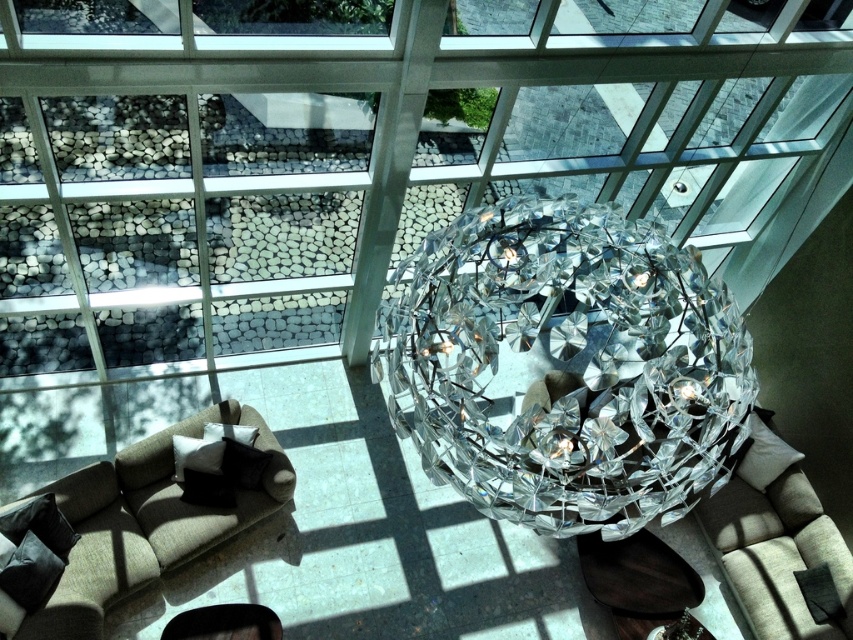
Which is below, clear crystal disco ball at center or beige fabric couch at lower right?

beige fabric couch at lower right

Is clear crystal disco ball at center positioned behind beige fabric couch at lower right?

No.

Is point (531, 269) behind point (828, 621)?

That is False.

This screenshot has width=853, height=640. Identify the location of clear crystal disco ball at center. (567, 365).

Is point (158, 496) less distant than point (782, 470)?

Yes, point (158, 496) is closer to viewer.

The width and height of the screenshot is (853, 640). Describe the element at coordinates (144, 522) in the screenshot. I see `beige fabric couch at lower left` at that location.

Between point (160, 508) and point (844, 544), which one is positioned in front?

Point (160, 508) is in front.

The width and height of the screenshot is (853, 640). Find the location of `beige fabric couch at lower left`. beige fabric couch at lower left is located at coordinates (144, 522).

Is clear crystal disco ball at center shorter than beige fabric couch at lower left?

No.

Does clear crystal disco ball at center appear on the right side of beige fabric couch at lower left?

Indeed, clear crystal disco ball at center is positioned on the right side of beige fabric couch at lower left.

Does point (514, 433) come closer to viewer compared to point (97, 592)?

Yes, it is in front of point (97, 592).

The image size is (853, 640). Find the location of `clear crystal disco ball at center`. clear crystal disco ball at center is located at coordinates (567, 365).